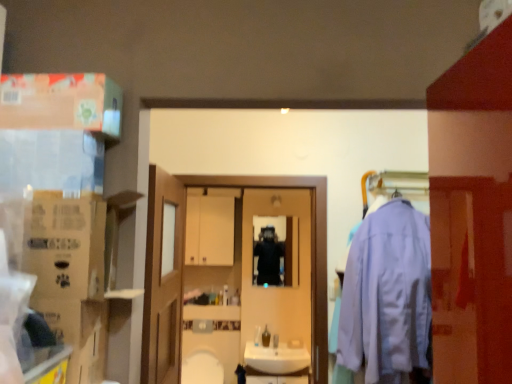
Question: Considering the relative sizes of white glossy sink at center and wooden door at center in the image provided, is white glossy sink at center shorter than wooden door at center?

Choices:
 (A) yes
 (B) no

Answer: (A)

Question: Is white glossy sink at center closer to the viewer compared to wooden door at center?

Choices:
 (A) yes
 (B) no

Answer: (B)

Question: From the image's perspective, is white glossy sink at center beneath wooden door at center?

Choices:
 (A) no
 (B) yes

Answer: (B)

Question: From a real-world perspective, is white glossy sink at center physically above wooden door at center?

Choices:
 (A) no
 (B) yes

Answer: (A)

Question: Is white glossy sink at center with wooden door at center?

Choices:
 (A) no
 (B) yes

Answer: (A)

Question: Which is correct: white glossy mirror at center is inside matte cardboard box at upper left, or outside of it?

Choices:
 (A) outside
 (B) inside

Answer: (A)

Question: Is white glossy mirror at center in front of or behind matte cardboard box at upper left in the image?

Choices:
 (A) behind
 (B) front

Answer: (A)

Question: Looking at their shapes, would you say white glossy mirror at center is wider or thinner than matte cardboard box at upper left?

Choices:
 (A) thin
 (B) wide

Answer: (A)

Question: From a real-world perspective, is white glossy mirror at center positioned above or below matte cardboard box at upper left?

Choices:
 (A) above
 (B) below

Answer: (B)

Question: In the image, is brown cardboard box at left, which is counted as the 1th cardboard box, starting from the top, positioned in front of or behind white glossy mirror at center?

Choices:
 (A) front
 (B) behind

Answer: (A)

Question: From the image's perspective, relative to white glossy mirror at center, is brown cardboard box at left, which is counted as the 1th cardboard box, starting from the top, above or below?

Choices:
 (A) below
 (B) above

Answer: (B)

Question: Is brown cardboard box at left, which is the 2th cardboard box from bottom to top, to the left or to the right of white glossy mirror at center in the image?

Choices:
 (A) left
 (B) right

Answer: (A)

Question: From a real-world perspective, is brown cardboard box at left, which is the 2th cardboard box from bottom to top, above or below white glossy mirror at center?

Choices:
 (A) below
 (B) above

Answer: (B)

Question: From the image's perspective, is black matte jacket at center positioned above or below white glossy sink at center?

Choices:
 (A) below
 (B) above

Answer: (B)

Question: Considering the positions of black matte jacket at center and white glossy sink at center in the image, is black matte jacket at center taller or shorter than white glossy sink at center?

Choices:
 (A) tall
 (B) short

Answer: (A)